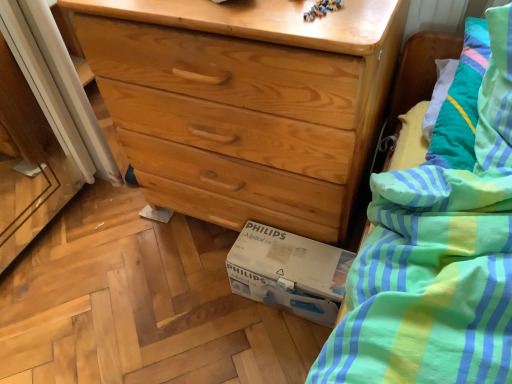
At what (x,y) coordinates should I click in order to perform the action: click on vacant space to the left of natural wood chest of drawers at center. Please return your answer as a coordinate pair (x, y). The image size is (512, 384). Looking at the image, I should click on 92,256.